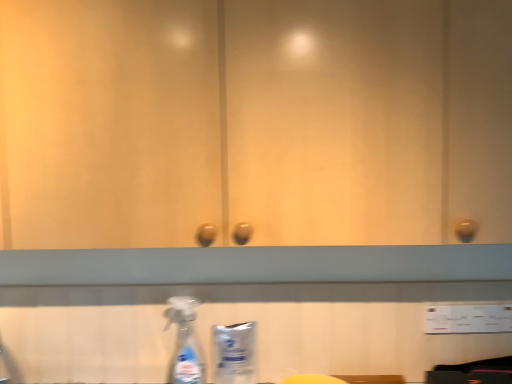
Question: From a real-world perspective, is yellow matte sponge at lower center physically above transparent plastic spray bottle at lower left?

Choices:
 (A) yes
 (B) no

Answer: (B)

Question: Does yellow matte sponge at lower center have a smaller size compared to transparent plastic spray bottle at lower left?

Choices:
 (A) yes
 (B) no

Answer: (B)

Question: Is yellow matte sponge at lower center taller than transparent plastic spray bottle at lower left?

Choices:
 (A) yes
 (B) no

Answer: (B)

Question: Is yellow matte sponge at lower center thinner than transparent plastic spray bottle at lower left?

Choices:
 (A) yes
 (B) no

Answer: (B)

Question: Is transparent plastic spray bottle at lower left surrounded by yellow matte sponge at lower center?

Choices:
 (A) yes
 (B) no

Answer: (B)

Question: Looking at the image, does transparent plastic spray bottle at lower left seem bigger or smaller compared to white plastic bottle at lower center?

Choices:
 (A) big
 (B) small

Answer: (A)

Question: Is transparent plastic spray bottle at lower left spatially inside white plastic bottle at lower center, or outside of it?

Choices:
 (A) outside
 (B) inside

Answer: (A)

Question: In the image, is transparent plastic spray bottle at lower left positioned in front of or behind white plastic bottle at lower center?

Choices:
 (A) behind
 (B) front

Answer: (B)

Question: From the image's perspective, is transparent plastic spray bottle at lower left above or below white plastic bottle at lower center?

Choices:
 (A) below
 (B) above

Answer: (B)

Question: From a real-world perspective, is yellow matte sponge at lower center positioned above or below white plastic bottle at lower center?

Choices:
 (A) above
 (B) below

Answer: (B)

Question: In terms of width, does yellow matte sponge at lower center look wider or thinner when compared to white plastic bottle at lower center?

Choices:
 (A) thin
 (B) wide

Answer: (B)

Question: In the image, is yellow matte sponge at lower center on the left side or the right side of white plastic bottle at lower center?

Choices:
 (A) right
 (B) left

Answer: (A)

Question: Is yellow matte sponge at lower center spatially inside white plastic bottle at lower center, or outside of it?

Choices:
 (A) outside
 (B) inside

Answer: (A)

Question: From the image's perspective, is white plastic bottle at lower center positioned above or below transparent plastic spray bottle at lower left?

Choices:
 (A) above
 (B) below

Answer: (B)

Question: Does point (251, 324) appear closer or farther from the camera than point (184, 332)?

Choices:
 (A) farther
 (B) closer

Answer: (B)